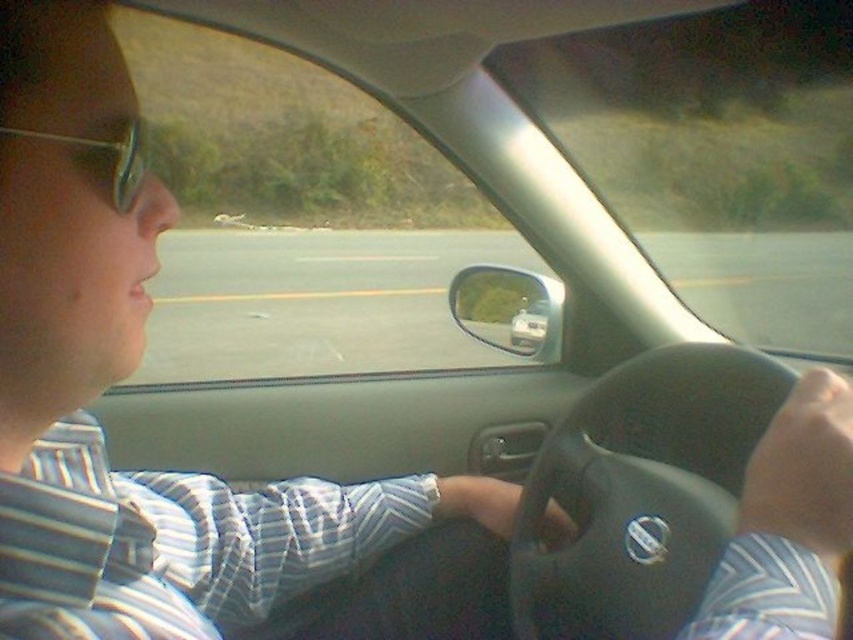
Question: Can you confirm if sunglasses at upper left is thinner than metallic silver car at center?

Choices:
 (A) no
 (B) yes

Answer: (B)

Question: Which point is closer to the camera?

Choices:
 (A) (749, 394)
 (B) (531, 317)

Answer: (A)

Question: Does black leather steering wheel at center come behind metallic silver car at center?

Choices:
 (A) no
 (B) yes

Answer: (A)

Question: Which point appears closest to the camera in this image?

Choices:
 (A) (128, 141)
 (B) (532, 326)
 (C) (648, 518)

Answer: (A)

Question: Which point appears farthest from the camera in this image?

Choices:
 (A) click(131, 173)
 (B) click(531, 330)
 (C) click(550, 432)

Answer: (B)

Question: Does sunglasses at upper left lie behind metallic silver car at center?

Choices:
 (A) yes
 (B) no

Answer: (B)